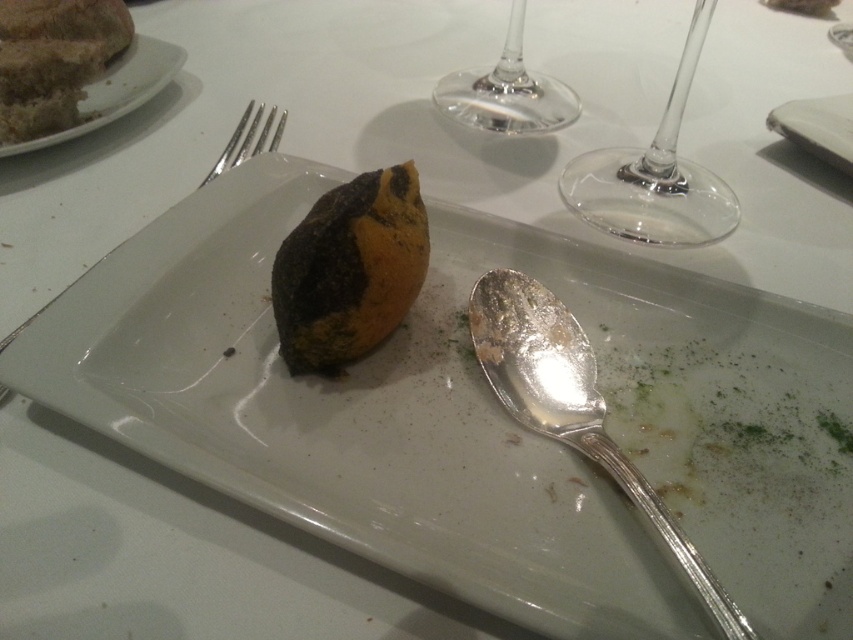
You are a food inspector checking the dining table. You see the rotten orange at center and the silver metallic spoon at lower right. Which object is taller?

The rotten orange at center is shorter than the silver metallic spoon at lower right, so the spoon is taller.

You are standing 30 inches away from the dining table. A point at coordinates point (651, 216) is located on the table. Based on the given information, can you reach that point without moving closer to the table?

The distance of point (651, 216) is 26.25 inches from the viewer. Since you are currently 30 inches away, you are 3.75 inches too far to reach the point without moving closer.

In the scene shown: You are a food inspector checking this dining table. You see the rotten orange at center and the silver metallic spoon at lower right. Which object is positioned higher relative to the other?

The rotten orange at center is above the silver metallic spoon at lower right.